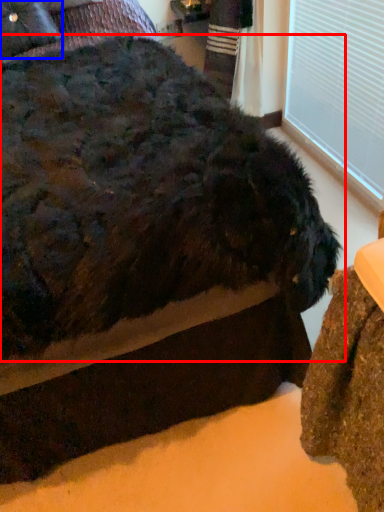
Question: Which point is closer to the camera, dog (highlighted by a red box) or pillow (highlighted by a blue box)?

Choices:
 (A) dog
 (B) pillow

Answer: (A)